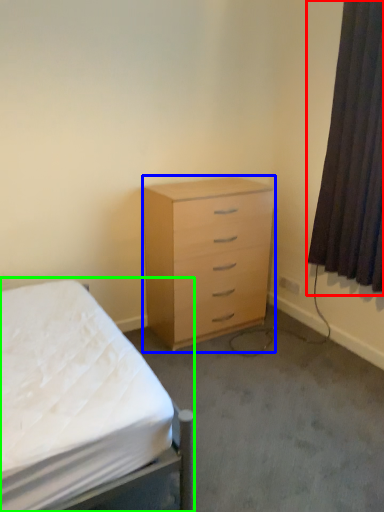
Question: Based on their relative distances, which object is farther from curtain (highlighted by a red box)? Choose from chest of drawers (highlighted by a blue box) and bed (highlighted by a green box).

Choices:
 (A) chest of drawers
 (B) bed

Answer: (B)